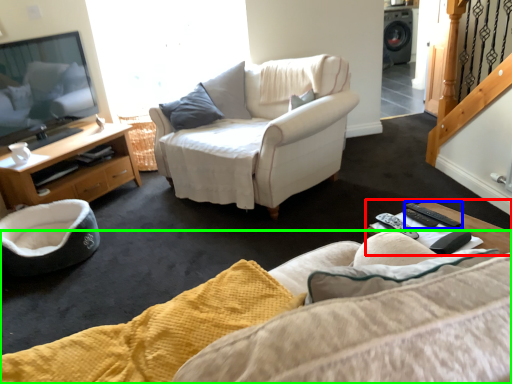
Question: Which object is the farthest from coffee table (highlighted by a red box)? Choose among these: remote (highlighted by a blue box) or studio couch (highlighted by a green box).

Choices:
 (A) remote
 (B) studio couch

Answer: (B)